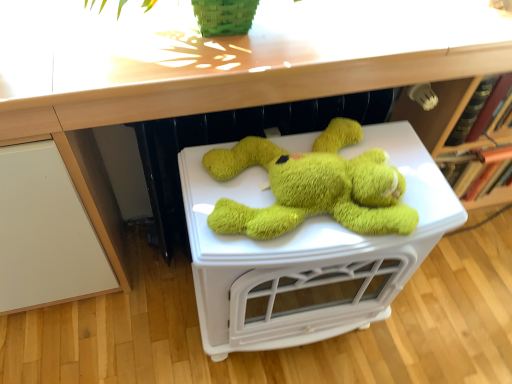
Question: Is soft green plush toy at center wider or thinner than wooden at upper center?

Choices:
 (A) wide
 (B) thin

Answer: (B)

Question: Is soft green plush toy at center to the left or to the right of wooden at upper center in the image?

Choices:
 (A) right
 (B) left

Answer: (B)

Question: In terms of size, does soft green plush toy at center appear bigger or smaller than wooden at upper center?

Choices:
 (A) small
 (B) big

Answer: (B)

Question: Looking at their shapes, would you say wooden at upper center is wider or thinner than soft green plush toy at center?

Choices:
 (A) thin
 (B) wide

Answer: (B)

Question: From the image's perspective, relative to soft green plush toy at center, is wooden at upper center above or below?

Choices:
 (A) above
 (B) below

Answer: (A)

Question: From a real-world perspective, is wooden at upper center above or below soft green plush toy at center?

Choices:
 (A) above
 (B) below

Answer: (A)

Question: Is wooden at upper center in front of or behind soft green plush toy at center in the image?

Choices:
 (A) front
 (B) behind

Answer: (A)